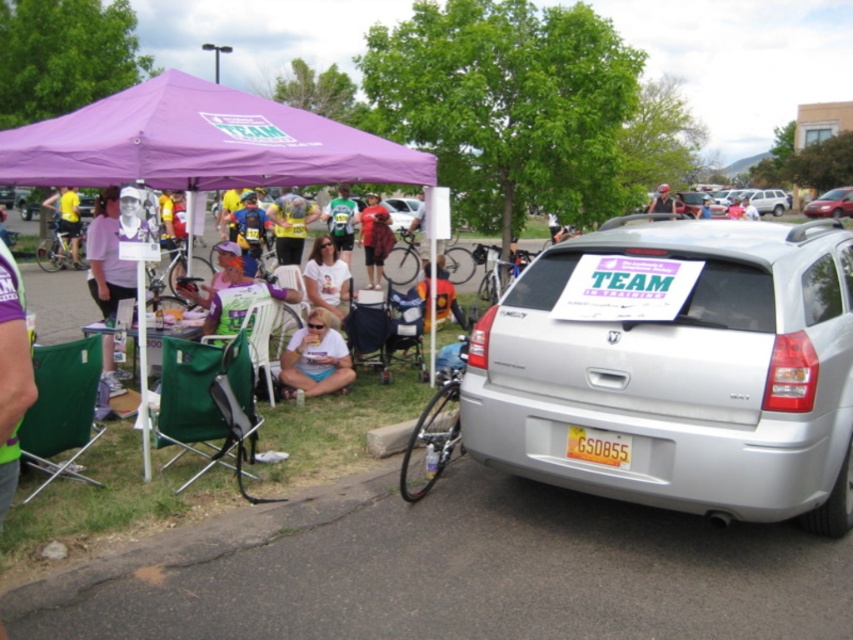
You are a participant in the event and need to move from the purple fabric canopy at upper left to the purple fabric canopy at upper center. Considering you are 1.8 meters tall, will you be able to walk between them without bending down?

The distance between the purple fabric canopy at upper center and the purple fabric canopy at upper left is 1.96 meters. Since you are 1.8 meters tall, you can walk between them without bending down as the distance is sufficient.

You are attending an outdoor event under a purple canopy labeled TEAM. You see a matte purple shirt at center and a silver metallic sedan at center. From your perspective, which object is positioned to the left?

The matte purple shirt at center is positioned to the left of the silver metallic sedan at center.

You are organizing a cycling event and need to ensure that the white fabric shirt at center and the matte black helmet at upper center can be displayed side by side on a 1.2 meter wide table. Based on their sizes, will both items fit comfortably on the table without overlapping?

The white fabric shirt at center is narrower than the matte black helmet at upper center. However, since the total width of both items combined would still depend on their individual measurements, but the description only states the shirt is narrower, not the exact dimensions, it is unclear if they will fit within the 1.2 meter table. Further measurements are needed.